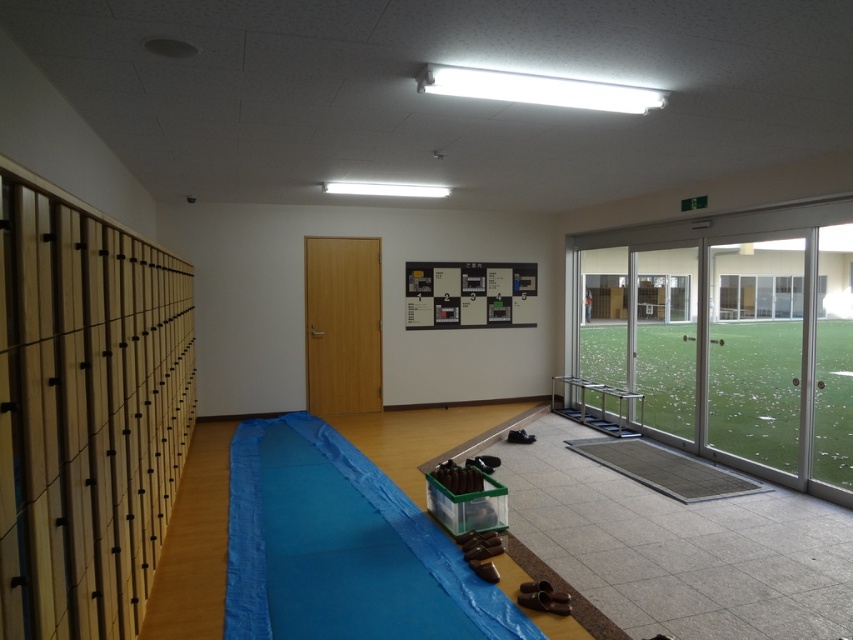
Question: Does transparent glass door at right lie in front of blue fabric mat at center?

Choices:
 (A) no
 (B) yes

Answer: (A)

Question: Is transparent glass door at right above blue fabric mat at center?

Choices:
 (A) yes
 (B) no

Answer: (A)

Question: Which point is closer to the camera?

Choices:
 (A) transparent glass door at right
 (B) blue fabric mat at center

Answer: (B)

Question: Can you confirm if transparent glass door at right is positioned to the right of blue fabric mat at center?

Choices:
 (A) yes
 (B) no

Answer: (A)

Question: Which point appears closest to the camera in this image?

Choices:
 (A) (265, 464)
 (B) (757, 243)

Answer: (B)